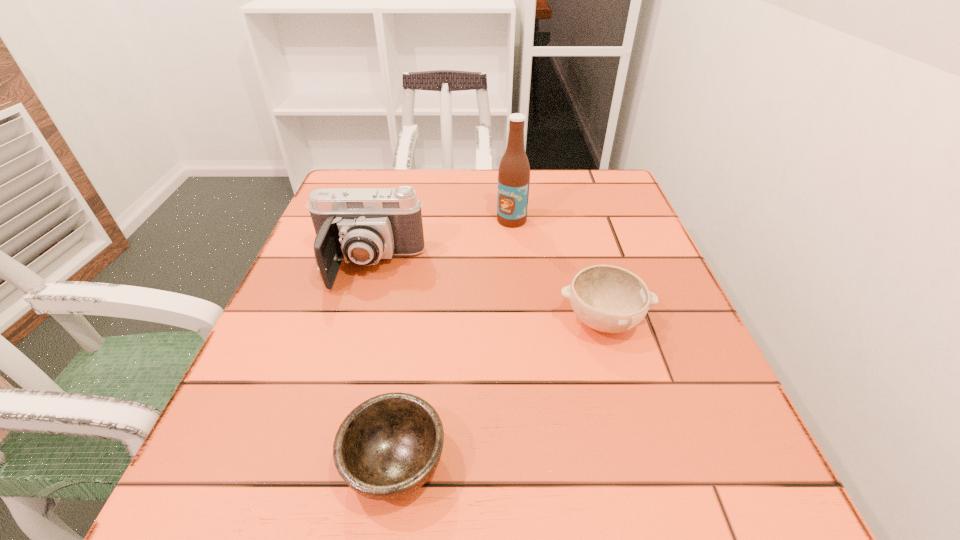
Image resolution: width=960 pixels, height=540 pixels. What are the coordinates of `vacant region that satisfies the following two spatial constraints: 1. at the front of the camera with an open lens cover; 2. on the left side of the shortest object` in the screenshot? It's located at (311, 463).